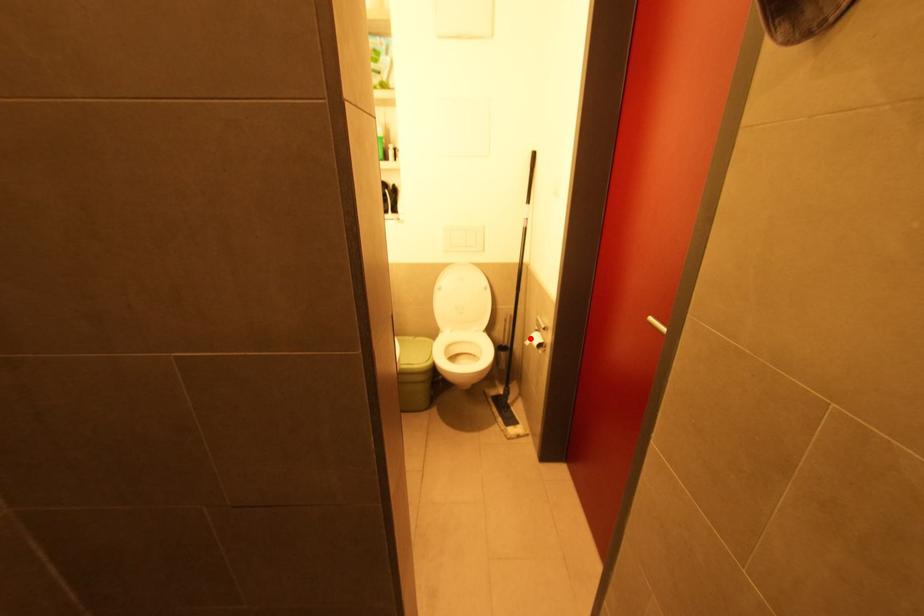
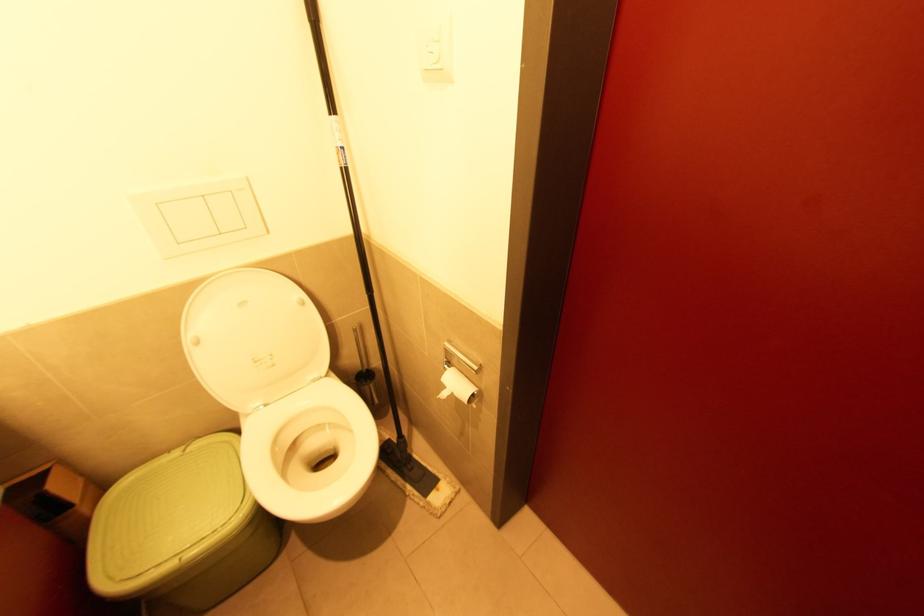
The point at the highlighted location is marked in the first image. Where is the corresponding point in the second image?

(444, 387)